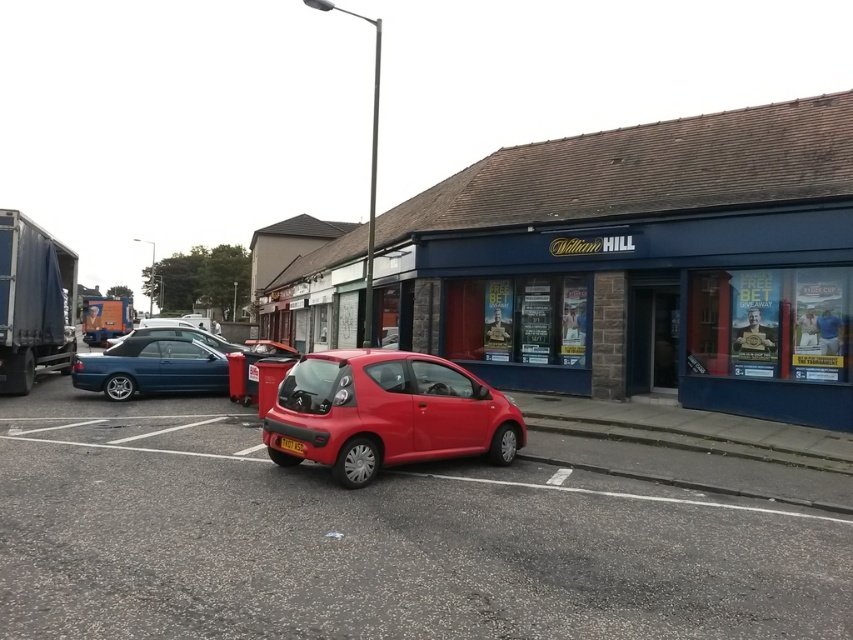
You are a delivery person trying to unload packages from the blue tarpaulin trailer truck at left and orange cardboard trailer truck at left. Which truck should you unload first if you need to access the one that is not obstructed by the other?

The blue tarpaulin trailer truck at left is positioned under the orange cardboard trailer truck at left, so you should unload the orange cardboard trailer truck at left first to avoid blocking access to the blue one.

You are a delivery driver who needs to park your 15 feet long truck between the blue tarpaulin trailer truck at left and the orange cardboard trailer truck at left. Is there enough space between them to park your truck without overlapping either?

The blue tarpaulin trailer truck at left and orange cardboard trailer truck at left are 82.51 feet apart. Since your truck is only 15 feet long, there is ample space between them to park without overlapping either.

You are standing at the curb in front of the William Hill betting shop. You want to walk to the point marked at coordinates point (x=201, y=636). How far will you have to walk to reach that point?

The distance of point (x=201, y=636) from viewer is 3.10 meters, so you will have to walk 3.10 meters to reach that point.